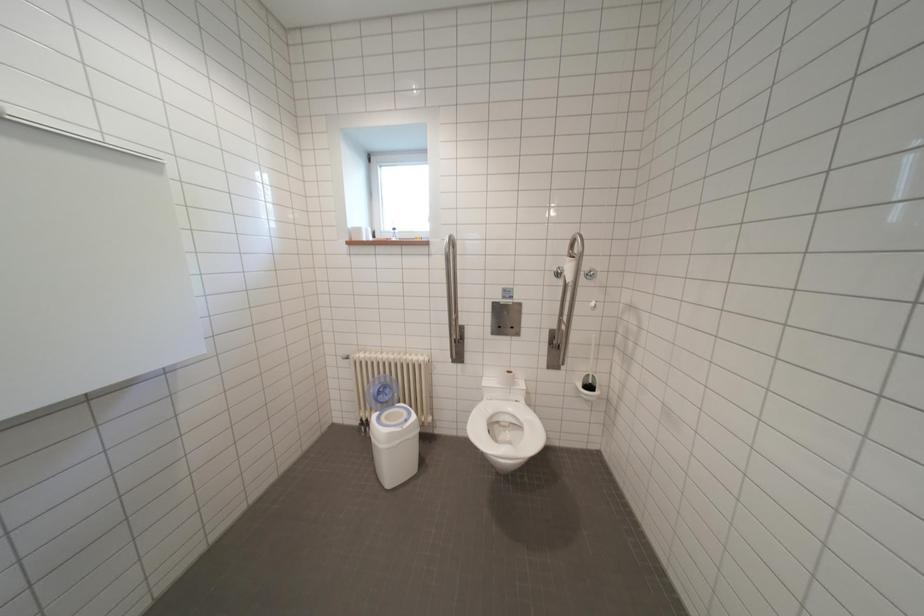
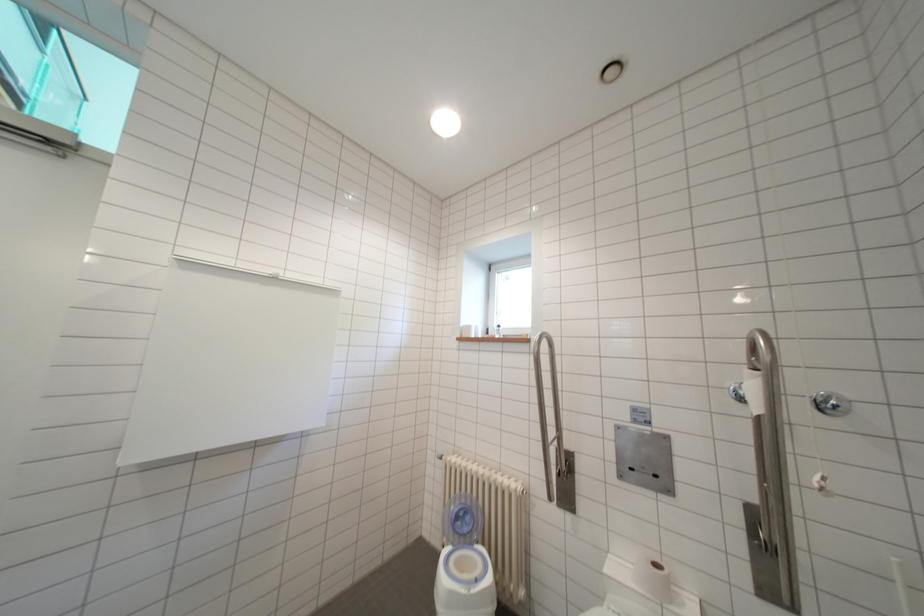
First-person continuous shooting, in which direction is the camera rotating?

The camera rotated toward left-up.